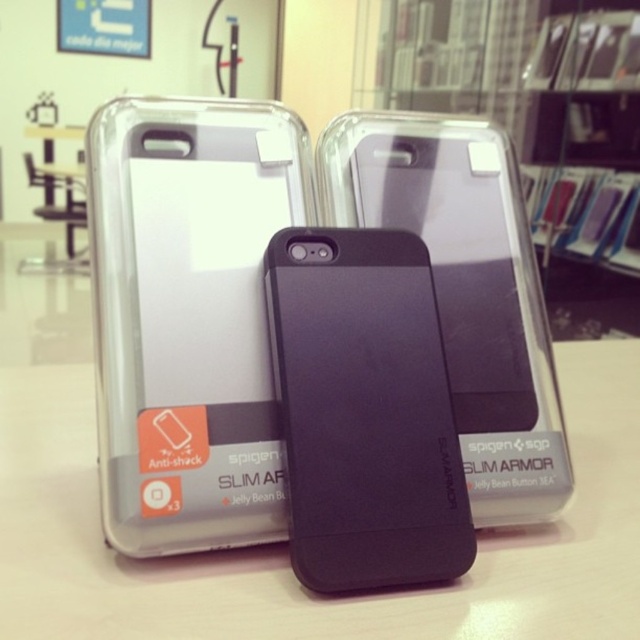
Question: Which object appears farthest from the camera in this image?

Choices:
 (A) black matte phone case at center
 (B) clear plastic phone case at left

Answer: (B)

Question: In this image, where is clear plastic phone case at left located relative to matte black phone at center?

Choices:
 (A) left
 (B) right

Answer: (A)

Question: Which of the following is the farthest from the observer?

Choices:
 (A) black matte phone case at center
 (B) white matte table at center
 (C) clear plastic phone case at left
 (D) matte black phone at center

Answer: (D)

Question: Does black matte phone case at center appear over matte black phone at center?

Choices:
 (A) yes
 (B) no

Answer: (B)

Question: Is clear plastic phone case at left positioned at the back of matte black phone at center?

Choices:
 (A) no
 (B) yes

Answer: (A)

Question: Among these objects, which one is nearest to the camera?

Choices:
 (A) matte black phone at center
 (B) white matte table at center
 (C) clear plastic phone case at left

Answer: (B)